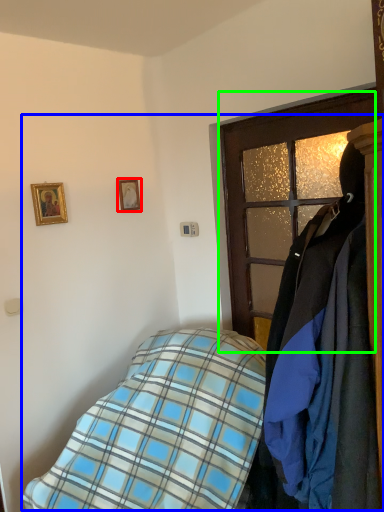
Question: Which object is the farthest from picture frame (highlighted by a red box)? Choose among these: bed (highlighted by a blue box) or door (highlighted by a green box).

Choices:
 (A) bed
 (B) door

Answer: (A)